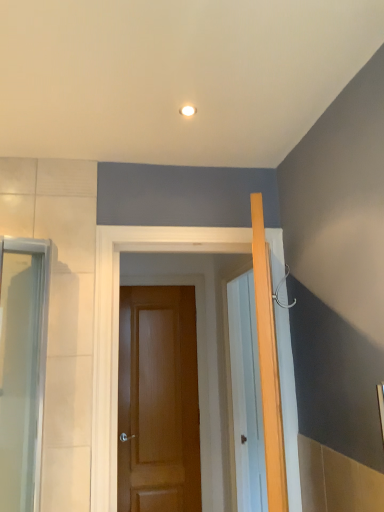
Question: From the image's perspective, is brown wooden door at center, which appears as the second door when viewed from the back, over glossy wood door at center, positioned as the 1th door in back-to-front order?

Choices:
 (A) yes
 (B) no

Answer: (A)

Question: Considering the relative sizes of brown wooden door at center, which appears as the second door when viewed from the back, and glossy wood door at center, marked as the second door in a front-to-back arrangement, in the image provided, is brown wooden door at center, which appears as the second door when viewed from the back, thinner than glossy wood door at center, marked as the second door in a front-to-back arrangement,?

Choices:
 (A) yes
 (B) no

Answer: (B)

Question: Can you confirm if brown wooden door at center, which appears as the second door when viewed from the back, is shorter than glossy wood door at center, marked as the second door in a front-to-back arrangement?

Choices:
 (A) yes
 (B) no

Answer: (A)

Question: Considering the relative sizes of brown wooden door at center, which is the first door in front-to-back order, and glossy wood door at center, marked as the second door in a front-to-back arrangement, in the image provided, is brown wooden door at center, which is the first door in front-to-back order, wider than glossy wood door at center, marked as the second door in a front-to-back arrangement,?

Choices:
 (A) no
 (B) yes

Answer: (B)

Question: From a real-world perspective, is brown wooden door at center, which appears as the second door when viewed from the back, located higher than glossy wood door at center, marked as the second door in a front-to-back arrangement?

Choices:
 (A) yes
 (B) no

Answer: (A)

Question: From the image's perspective, is brown wooden door at center, which appears as the second door when viewed from the back, positioned above or below clear glass screen door at left?

Choices:
 (A) below
 (B) above

Answer: (A)

Question: In terms of width, does brown wooden door at center, which is the first door in front-to-back order, look wider or thinner when compared to clear glass screen door at left?

Choices:
 (A) thin
 (B) wide

Answer: (A)

Question: Considering the relative positions of brown wooden door at center, which is the first door in front-to-back order, and clear glass screen door at left in the image provided, is brown wooden door at center, which is the first door in front-to-back order, to the left or to the right of clear glass screen door at left?

Choices:
 (A) left
 (B) right

Answer: (B)

Question: Is brown wooden door at center, which appears as the second door when viewed from the back, inside the boundaries of clear glass screen door at left, or outside?

Choices:
 (A) inside
 (B) outside

Answer: (B)

Question: Is brown wooden door at center, which appears as the second door when viewed from the back, situated inside glossy wood door at center, positioned as the 1th door in back-to-front order, or outside?

Choices:
 (A) outside
 (B) inside

Answer: (A)

Question: Relative to glossy wood door at center, marked as the second door in a front-to-back arrangement, is brown wooden door at center, which is the first door in front-to-back order, in front or behind?

Choices:
 (A) front
 (B) behind

Answer: (A)

Question: Considering the positions of point (104, 225) and point (190, 287), is point (104, 225) closer or farther from the camera than point (190, 287)?

Choices:
 (A) farther
 (B) closer

Answer: (B)

Question: From the image's perspective, relative to glossy wood door at center, positioned as the 1th door in back-to-front order, is brown wooden door at center, which is the first door in front-to-back order, above or below?

Choices:
 (A) above
 (B) below

Answer: (A)

Question: Would you say glossy wood door at center, positioned as the 1th door in back-to-front order, is to the left or to the right of clear glass screen door at left in the picture?

Choices:
 (A) left
 (B) right

Answer: (B)

Question: From the image's perspective, is glossy wood door at center, marked as the second door in a front-to-back arrangement, located above or below clear glass screen door at left?

Choices:
 (A) below
 (B) above

Answer: (A)